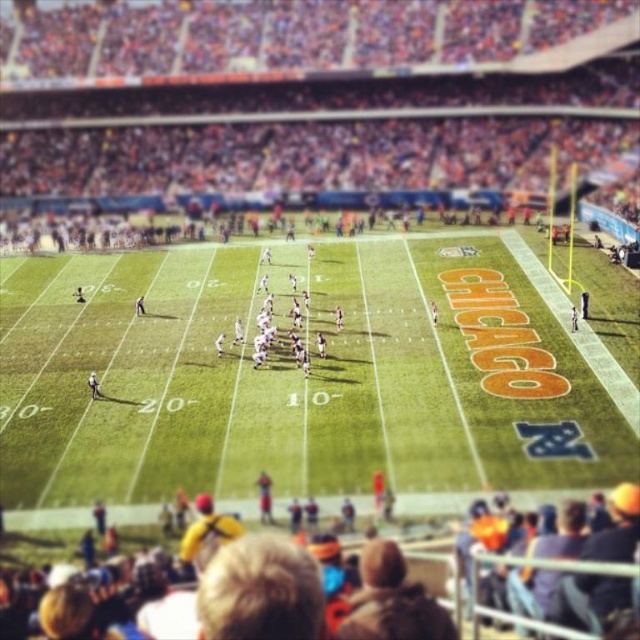
You are a photographer trying to capture a clear shot of the white matte football team at center during the game at Soldier Field. However, the green grass field at center is blocking your view. Can you adjust your position to see the team clearly?

The green grass field at center is in front of the white matte football team at center, so moving your position to get a higher angle or shifting sideways might allow you to see around the obstruction caused by the green grass field at center.

You are a photographer planning to capture the entire green grass field at center and the multicolored fabric crowd at lower center in one shot. Based on their widths, which object should you position closer to the camera to ensure both fit within the frame?

Since the green grass field at center is wider than the multicolored fabric crowd at lower center, you should position the green grass field at center closer to the camera to ensure both fit within the frame.

You are a photographer at Soldier Field and want to capture the green grass field at center in your photo. The camera you are using has a focus point at coordinate point (301, 374). Will this coordinate help you focus on the green grass field at center?

Yes, the point (301, 374) corresponds to the green grass field at center, so this coordinate will help focus on it.